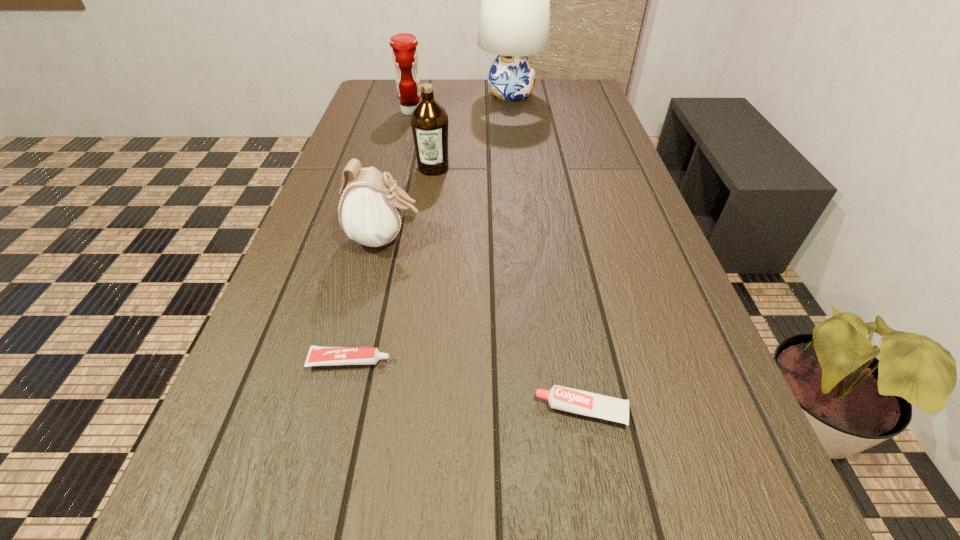
This screenshot has width=960, height=540. I want to click on lampshade, so click(514, 22).

Identify the location of condiment. The width and height of the screenshot is (960, 540). (405, 56).

The height and width of the screenshot is (540, 960). I want to click on olive oil, so click(429, 121).

Locate an element on the screen. The height and width of the screenshot is (540, 960). pouch is located at coordinates (370, 212).

This screenshot has width=960, height=540. Identify the location of the third shortest object. pos(370,212).

I want to click on the right toothpaste, so (576, 401).

The image size is (960, 540). I want to click on the nearest object, so click(x=576, y=401).

You are a GUI agent. You are given a task and a screenshot of the screen. Output one action in this format:
    pyautogui.click(x=<x>, y=<y>)
    Task: Click on the farther toothpaste
    This screenshot has width=960, height=540.
    Given the screenshot: What is the action you would take?
    (318, 356)

Identify the location of the left toothpaste. The width and height of the screenshot is (960, 540). (318, 356).

Image resolution: width=960 pixels, height=540 pixels. I want to click on free spot located 0.320m on the front-facing side of the tallest object, so click(382, 94).